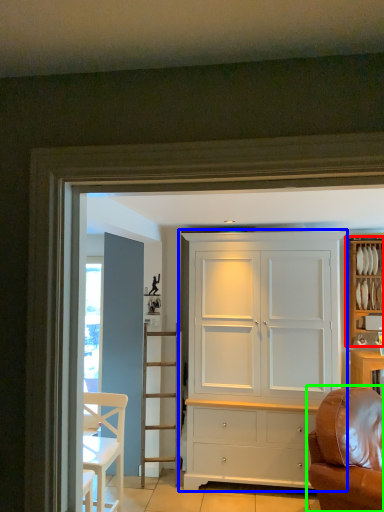
Question: Based on their relative distances, which object is farther from cabinetry (highlighted by a red box)? Choose from cupboard (highlighted by a blue box) and studio couch (highlighted by a green box).

Choices:
 (A) cupboard
 (B) studio couch

Answer: (B)